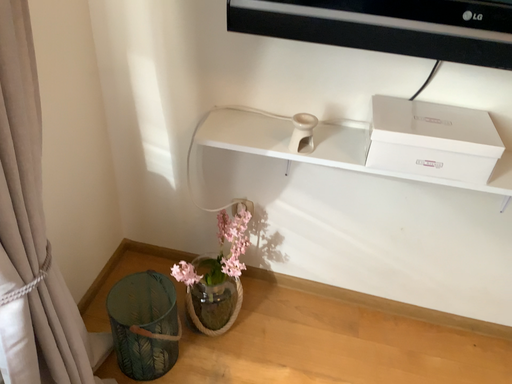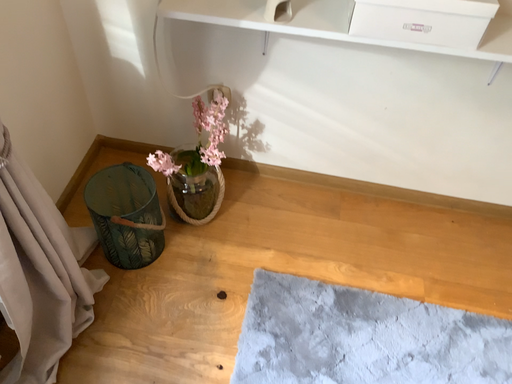
Question: Which way did the camera rotate in the video?

Choices:
 (A) rotated upward
 (B) rotated downward

Answer: (B)